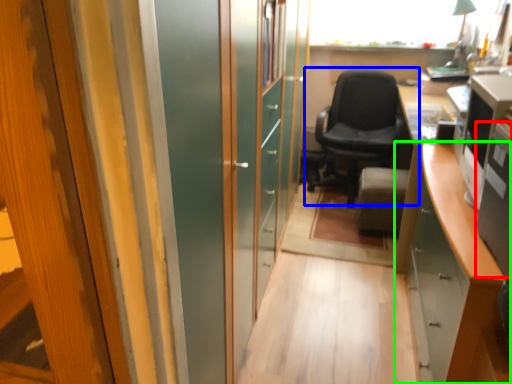
Question: Based on their relative distances, which object is nearer to desktop computer (highlighted by a red box)? Choose from chair (highlighted by a blue box) and cabinetry (highlighted by a green box).

Choices:
 (A) chair
 (B) cabinetry

Answer: (B)